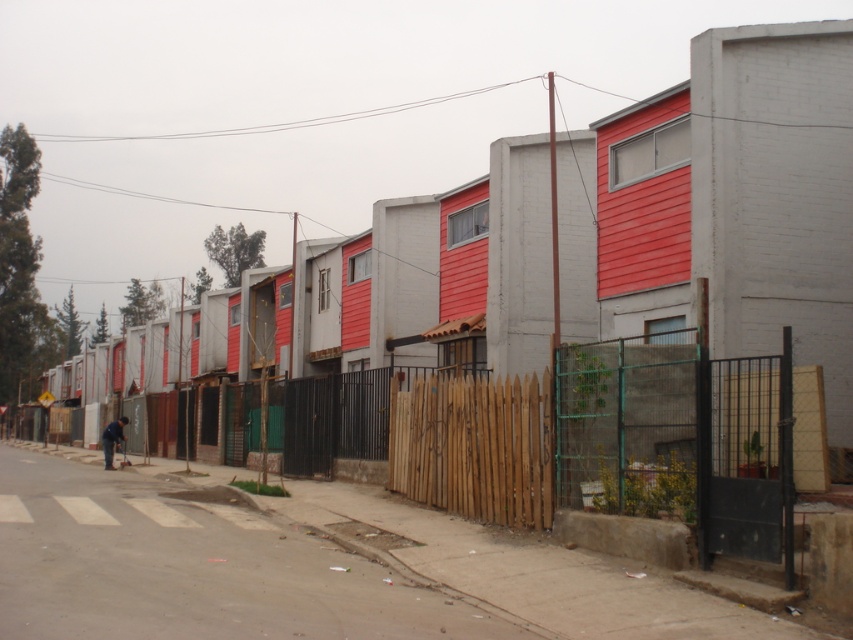
You are a delivery person trying to reach the entrance of the building. You see the concrete sidewalk at lower center and the brown wooden fence at center. Which path should you take to avoid the fence?

You should take the concrete sidewalk at lower center because it is shorter than the brown wooden fence at center, making it easier to navigate around the fence.